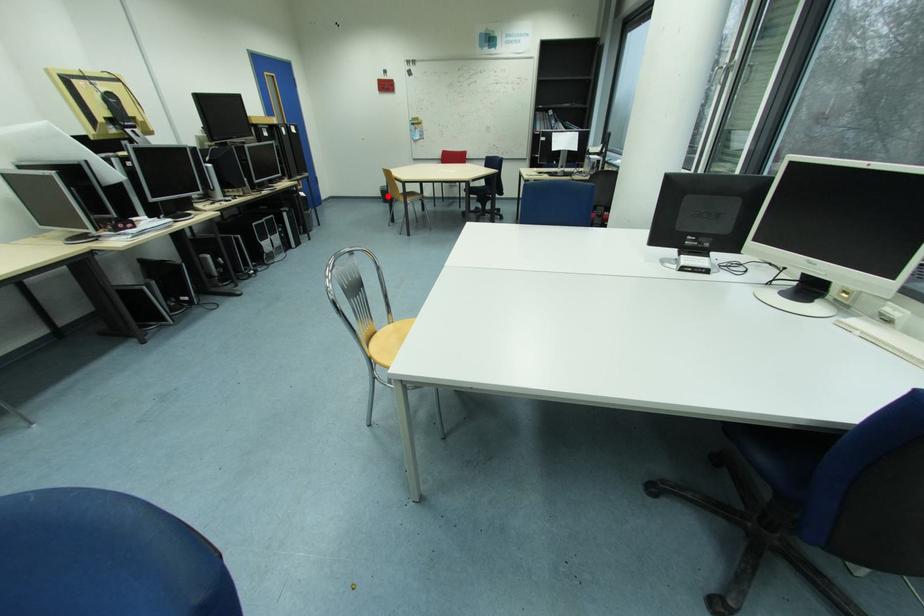
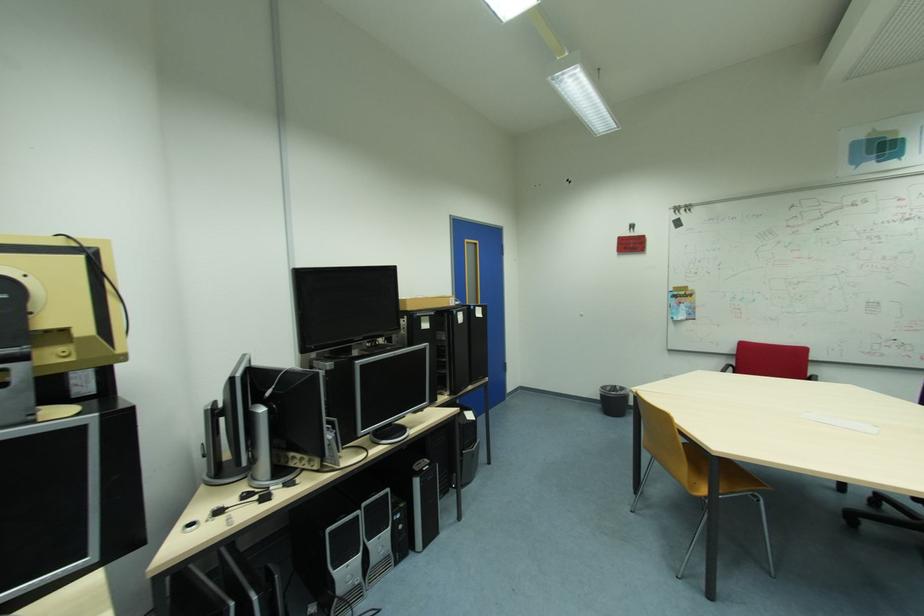
In the second image, find the point that corresponds to the highlighted location in the first image.

(605, 400)